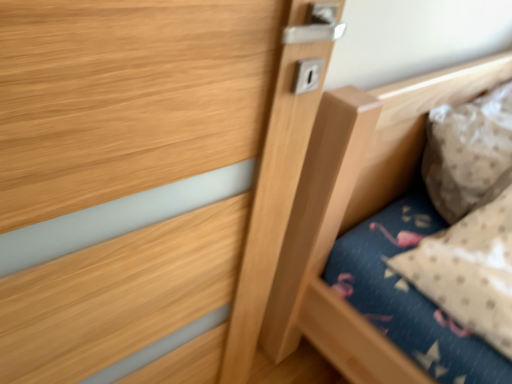
In order to click on beige dotted pillow at right in this screenshot , I will do `click(468, 152)`.

Describe the element at coordinates (468, 152) in the screenshot. I see `beige dotted pillow at right` at that location.

The height and width of the screenshot is (384, 512). In order to click on beige dotted pillow at right in this screenshot , I will do `click(468, 152)`.